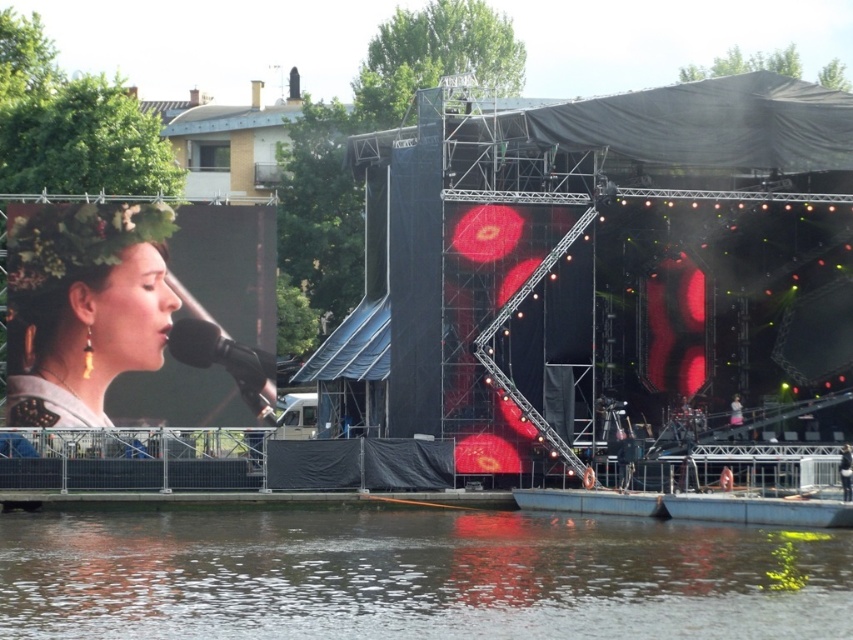
You are a photographer at the outdoor concert setup by the water. You need to capture a photo that includes both the smooth water at lower center and the matte floral crown at left. Based on their positions, which object should appear lower in the final photo?

The smooth water at lower center should appear lower in the photo than the matte floral crown at left because it is positioned below it.

You are a stagehand at the outdoor concert setup by the water. You need to place a 50 feet long safety rope between the smooth water at lower center and the matte floral crown at left to secure the stage area. Will the rope be long enough?

The distance between the smooth water at lower center and the matte floral crown at left is 48.94 feet. Since the rope is 50 feet long, it will be long enough to span the distance between them.